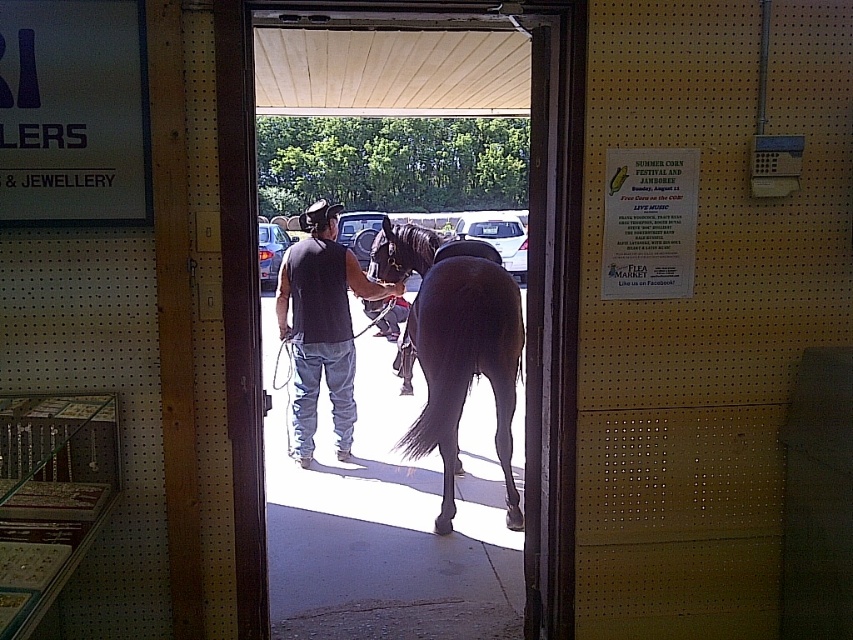
Who is shorter, wooden door at center or dark gray shirt at center?

wooden door at center

Which is below, wooden door at center or dark gray shirt at center?

dark gray shirt at center is lower down.

Between point (527, 438) and point (306, 412), which one is positioned behind?

Positioned behind is point (306, 412).

You are a GUI agent. You are given a task and a screenshot of the screen. Output one action in this format:
    pyautogui.click(x=<x>, y=<y>)
    Task: Click on the wooden door at center
    The height and width of the screenshot is (640, 853).
    Given the screenshot: What is the action you would take?
    pyautogui.click(x=543, y=314)

Is point (546, 310) positioned behind point (479, 326)?

No, it is not.

Does wooden door at center have a lesser width compared to brown glossy horse at center?

No.

Image resolution: width=853 pixels, height=640 pixels. Identify the location of wooden door at center. (543, 314).

Does brown glossy horse at center have a greater width compared to dark gray shirt at center?

Yes, brown glossy horse at center is wider than dark gray shirt at center.

The image size is (853, 640). Describe the element at coordinates (456, 348) in the screenshot. I see `brown glossy horse at center` at that location.

This screenshot has width=853, height=640. Find the location of `brown glossy horse at center`. brown glossy horse at center is located at coordinates [456, 348].